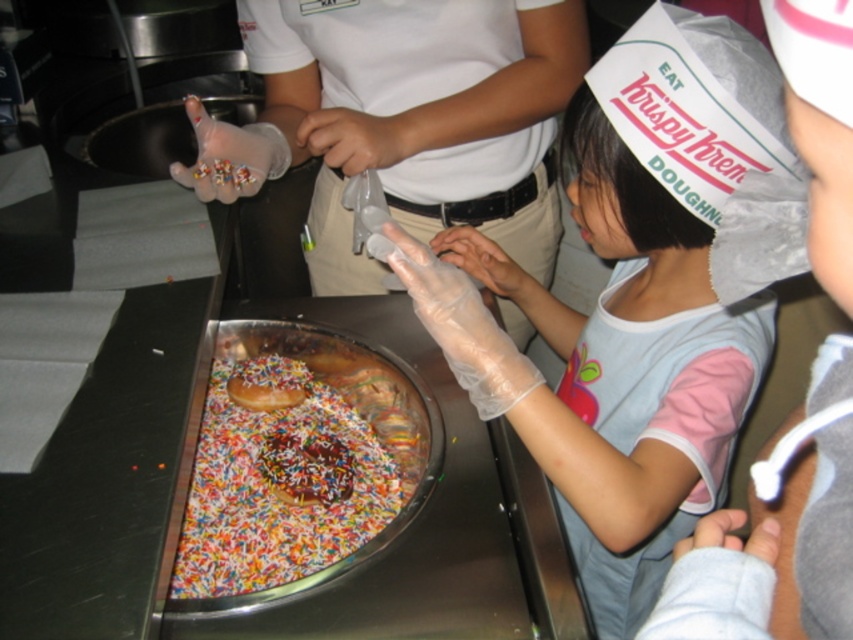
Question: Which object appears farthest from the camera in this image?

Choices:
 (A) colorful sprinkled donuts at center
 (B) glazed chocolate donut at center
 (C) transparent plastic glove at upper center
 (D) chocolate-coated donut at center

Answer: (B)

Question: Which point is farther to the camera?

Choices:
 (A) transparent plastic glove at upper center
 (B) chocolate-coated donut at center
 (C) glazed chocolate donut at center

Answer: (C)

Question: From the image, what is the correct spatial relationship of colorful sprinkled donuts at center in relation to chocolate-coated donut at center?

Choices:
 (A) above
 (B) below

Answer: (A)

Question: From the image, what is the correct spatial relationship of transparent plastic glove at upper center in relation to chocolate-coated donut at center?

Choices:
 (A) below
 (B) above

Answer: (B)

Question: Which object is the closest to the chocolate-coated donut at center?

Choices:
 (A) glazed chocolate donut at center
 (B) transparent plastic glove at upper center

Answer: (A)

Question: Where is chocolate-coated donut at center located in relation to glazed chocolate donut at center in the image?

Choices:
 (A) left
 (B) right

Answer: (B)